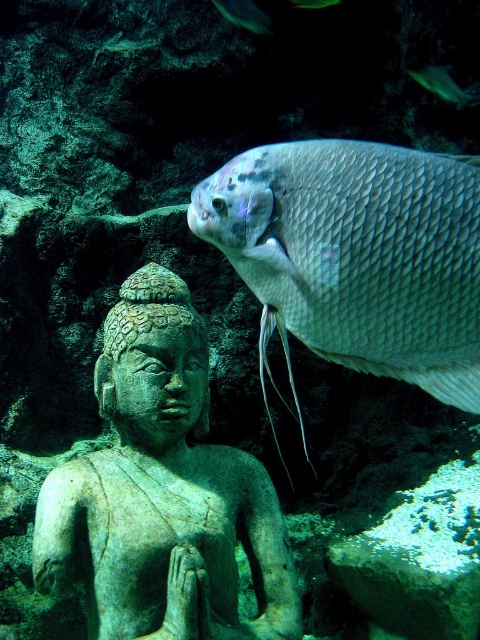
You are a marine biologist observing an underwater scene. You notice the green stone statue at center and the shiny silver fish at upper right. Based on their sizes, which object would require more space to accommodate in an aquarium tank?

The green stone statue at center requires more space in an aquarium tank because its width surpasses that of the shiny silver fish at upper right.

You are a marine biologist observing this underwater scene. You need to determine which object is larger between the green stone statue at center and the shiny silver fish at upper right based on their sizes. Which one is bigger?

The green stone statue at center is bigger than the shiny silver fish at upper right according to the description.